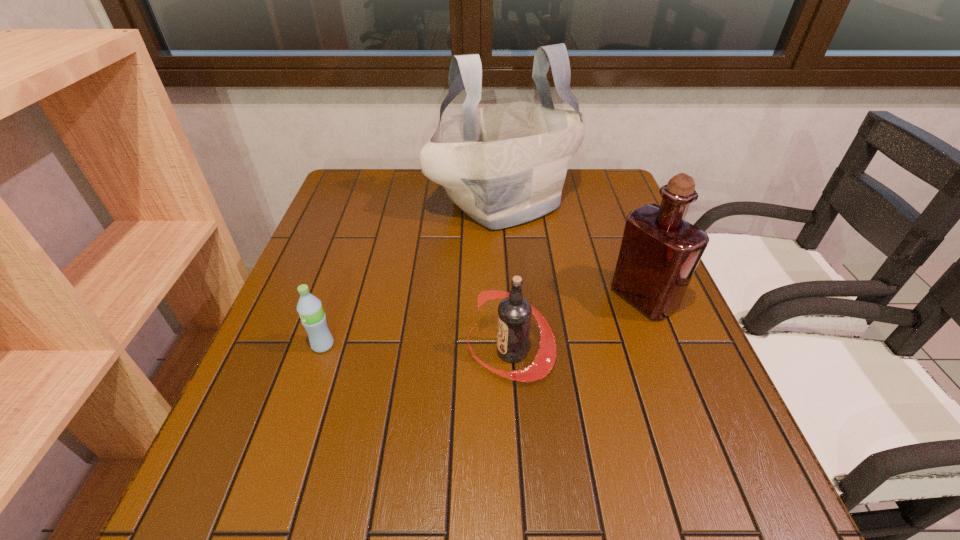
At what (x,y) coordinates should I click in order to perform the action: click on shopping bag. Please return your answer as a coordinate pair (x, y). Looking at the image, I should click on (503, 165).

Where is `the tallest object`? The width and height of the screenshot is (960, 540). the tallest object is located at coordinates (503, 165).

What are the coordinates of `liquor` in the screenshot? It's located at (659, 252).

The image size is (960, 540). I want to click on the third shortest object, so click(x=659, y=252).

Locate an element on the screen. Image resolution: width=960 pixels, height=540 pixels. the third tallest object is located at coordinates (514, 312).

The height and width of the screenshot is (540, 960). I want to click on the leftmost object, so click(309, 307).

Where is `the shortest object`? the shortest object is located at coordinates (309, 307).

Identify the location of vacant space located 0.240m on the left of the farthest object. Image resolution: width=960 pixels, height=540 pixels. (348, 203).

Locate an element on the screen. The image size is (960, 540). vacant space located 0.280m on the front of the liquor is located at coordinates (701, 446).

Where is `vacant space positioned on the label of the second shortest object`? The width and height of the screenshot is (960, 540). vacant space positioned on the label of the second shortest object is located at coordinates (336, 352).